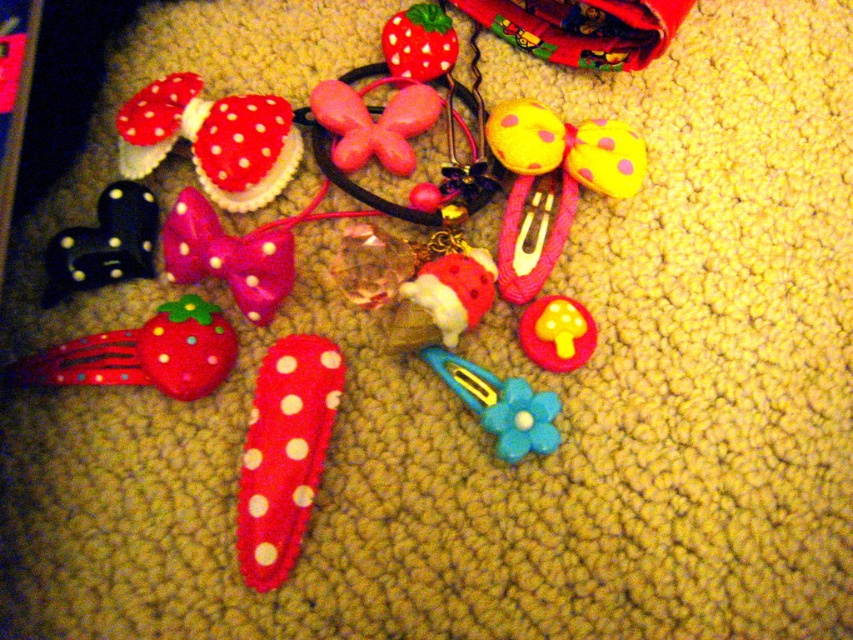
Question: Does red felt hair clip at lower center lie in front of rubberized pink butterfly at center?

Choices:
 (A) yes
 (B) no

Answer: (A)

Question: Is red felt strawberry hair clip at lower left smaller than rubberized pink butterfly at center?

Choices:
 (A) yes
 (B) no

Answer: (B)

Question: Is the position of yellow polka dot bow at center more distant than that of yellow matte mushroom at center?

Choices:
 (A) yes
 (B) no

Answer: (A)

Question: Which point appears farthest from the camera in this image?

Choices:
 (A) (x=337, y=100)
 (B) (x=173, y=80)

Answer: (A)

Question: Which point appears farthest from the camera in this image?

Choices:
 (A) (213, 218)
 (B) (256, 397)

Answer: (A)

Question: Which is farther from the white polka dot fabric mushroom at upper left?

Choices:
 (A) rubberized pink butterfly at center
 (B) black felt bow at left

Answer: (A)